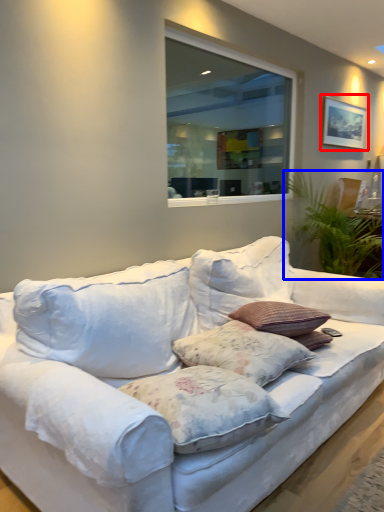
Question: Which point is closer to the camera, picture frame (highlighted by a red box) or plant (highlighted by a blue box)?

Choices:
 (A) picture frame
 (B) plant

Answer: (B)